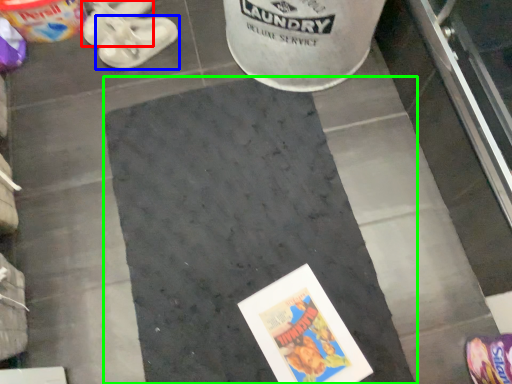
Question: Considering the real-world distances, which object is closest to footwear (highlighted by a red box)? footwear (highlighted by a blue box) or concrete (highlighted by a green box).

Choices:
 (A) footwear
 (B) concrete

Answer: (A)